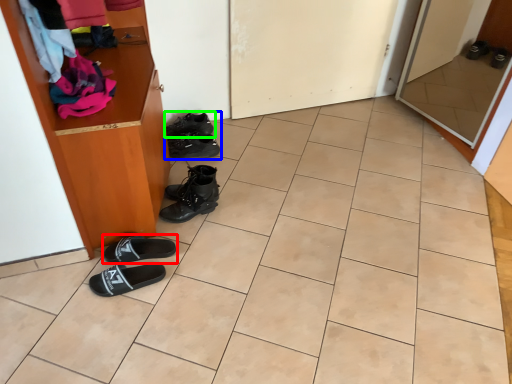
Question: Based on their relative distances, which object is nearer to footwear (highlighted by a red box)? Choose from footwear (highlighted by a blue box) and footwear (highlighted by a green box).

Choices:
 (A) footwear
 (B) footwear

Answer: (A)